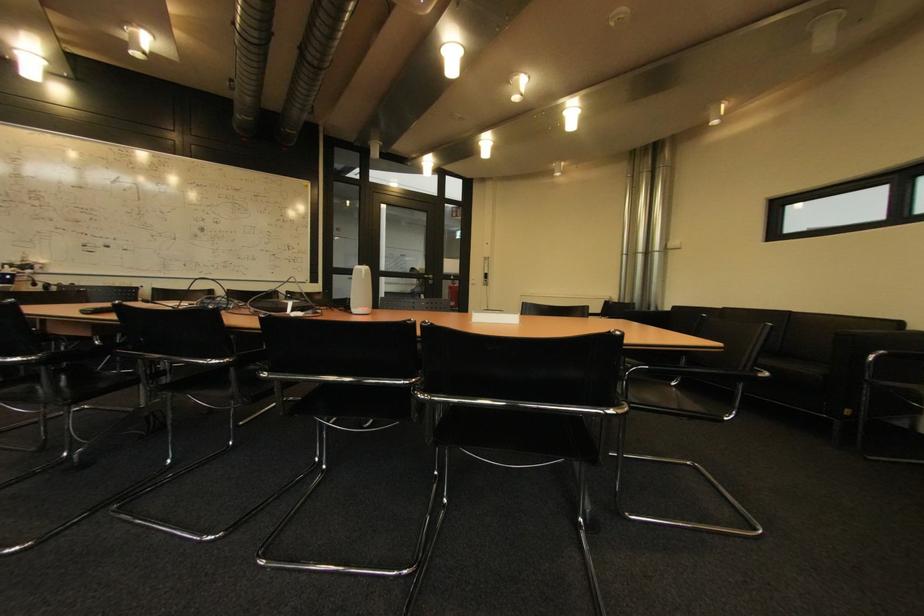
You are a GUI agent. You are given a task and a screenshot of the screen. Output one action in this format:
    pyautogui.click(x=<x>, y=<y>)
    Task: Click on the black sofa sitting surface
    The width and height of the screenshot is (924, 616).
    Given the screenshot: What is the action you would take?
    pyautogui.click(x=793, y=363)